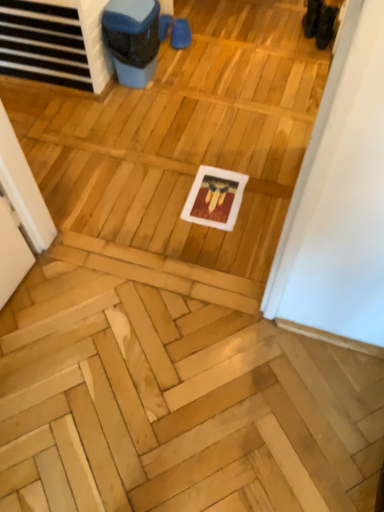
In order to face black suede shoes at upper right, should I rotate leftwards or rightwards?

To align with it, rotate right about 17.593°.

This screenshot has width=384, height=512. In order to click on black suede shoes at upper right in this screenshot , I will do `click(325, 26)`.

The height and width of the screenshot is (512, 384). Describe the element at coordinates (325, 26) in the screenshot. I see `black suede shoes at upper right` at that location.

Find the location of `black suede shoes at upper right`. black suede shoes at upper right is located at coordinates (325, 26).